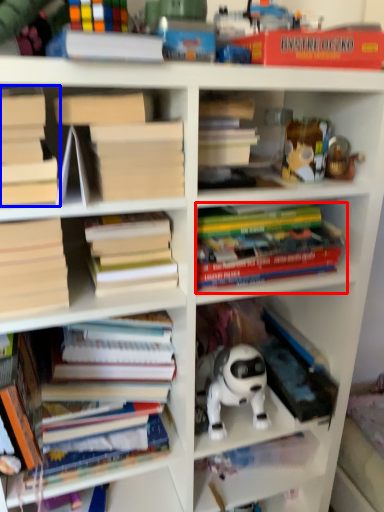
Question: Which point is closer to the camera, book (highlighted by a red box) or book (highlighted by a blue box)?

Choices:
 (A) book
 (B) book

Answer: (B)